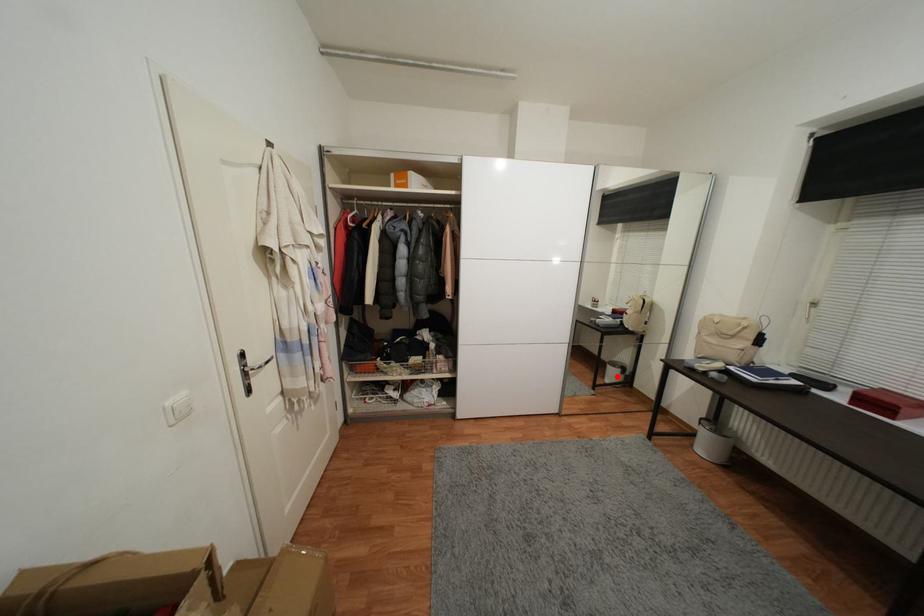
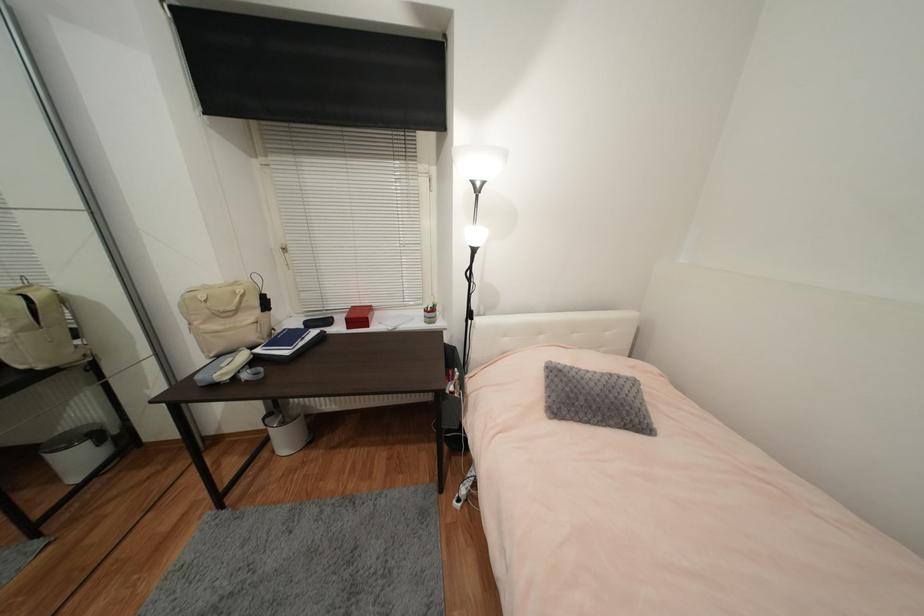
Question: I am providing you with two images of the same scene from different viewpoints. Given a red point in image1, look at the same physical point in image2. Is it:

Choices:
 (A) Closer to the viewpoint
 (B) Farther from the viewpoint

Answer: (A)